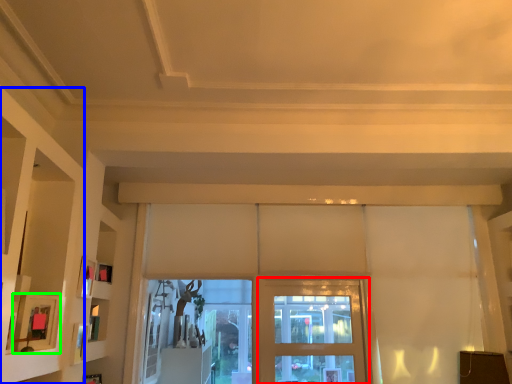
Question: Estimate the real-world distances between objects in this image. Which object is closer to screen door (highlighted by a red box), shelf (highlighted by a blue box) or picture frame (highlighted by a green box)?

Choices:
 (A) shelf
 (B) picture frame

Answer: (B)